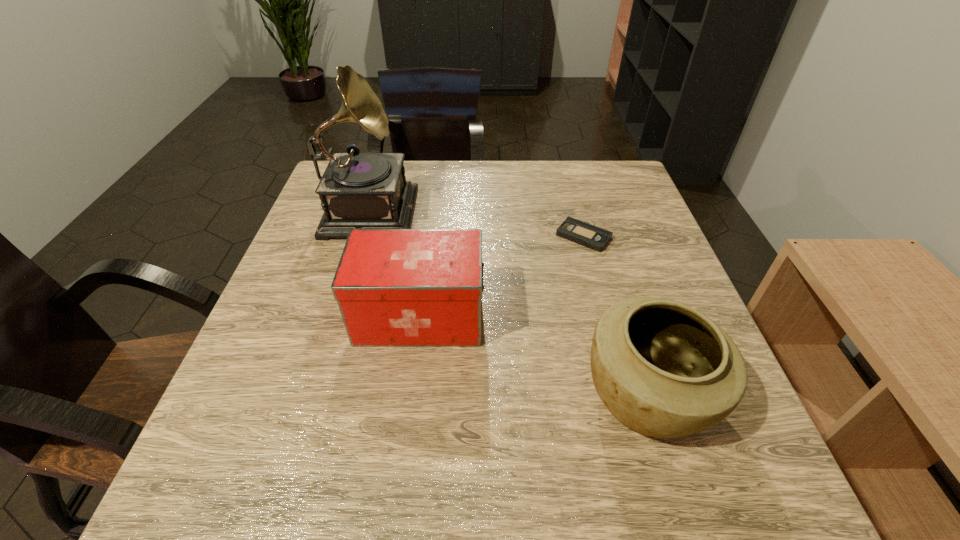
Where is `free space at the far right corner of the desktop`? free space at the far right corner of the desktop is located at coordinates (611, 180).

In the image, there is a desktop. At what (x,y) coordinates should I click in order to perform the action: click on vacant region at the near right corner. Please return your answer as a coordinate pair (x, y). The width and height of the screenshot is (960, 540). Looking at the image, I should click on (737, 495).

Locate an element on the screen. The height and width of the screenshot is (540, 960). free spot between the first-aid kit and the videotape is located at coordinates (502, 276).

Locate an element on the screen. The height and width of the screenshot is (540, 960). unoccupied area between the pottery and the record player is located at coordinates (509, 301).

The height and width of the screenshot is (540, 960). What are the coordinates of `free space between the first-aid kit and the videotape` in the screenshot? It's located at (502, 276).

The image size is (960, 540). What are the coordinates of `free spot between the record player and the pottery` in the screenshot? It's located at (509, 301).

Find the location of a particular element. The width and height of the screenshot is (960, 540). object that stands as the closest to the first-aid kit is located at coordinates (358, 190).

The image size is (960, 540). Find the location of `object that is the third closest to the pottery`. object that is the third closest to the pottery is located at coordinates (358, 190).

Image resolution: width=960 pixels, height=540 pixels. What are the coordinates of `free spot that satisfies the following two spatial constraints: 1. on the horn of the pottery; 2. on the left side of the record player` in the screenshot? It's located at (312, 395).

At what (x,y) coordinates should I click in order to perform the action: click on free space in the image that satisfies the following two spatial constraints: 1. on the front side of the videotape; 2. on the right side of the pottery. Please return your answer as a coordinate pair (x, y). This screenshot has width=960, height=540. Looking at the image, I should click on (626, 395).